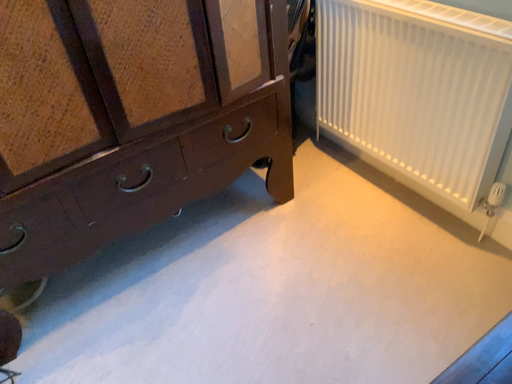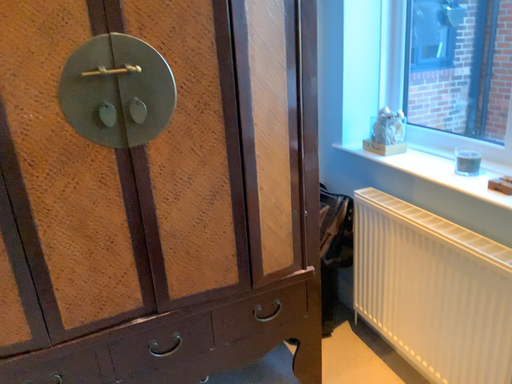
Question: How did the camera likely rotate when shooting the video?

Choices:
 (A) rotated right
 (B) rotated left

Answer: (B)